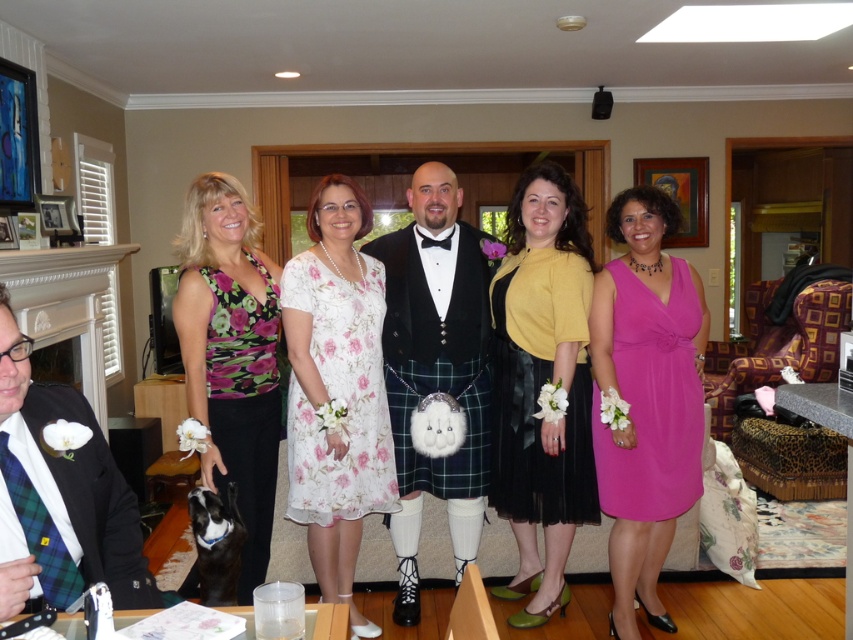
You are a photographer trying to capture a clear shot of both the floral chiffon dress at center and the green plaid kilt at center. Since you can only focus on one subject at a time, which one should you choose to ensure the other is still somewhat in focus?

The floral chiffon dress at center is closer to the viewer than the green plaid kilt at center. To ensure both are somewhat in focus, you should focus on the floral chiffon dress at center because it is closer, and the green plaid kilt at center will be slightly out of focus but still recognizable.